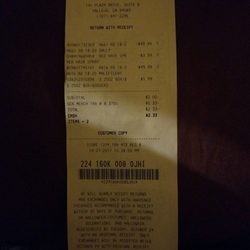
I want to click on table, so click(201, 142).